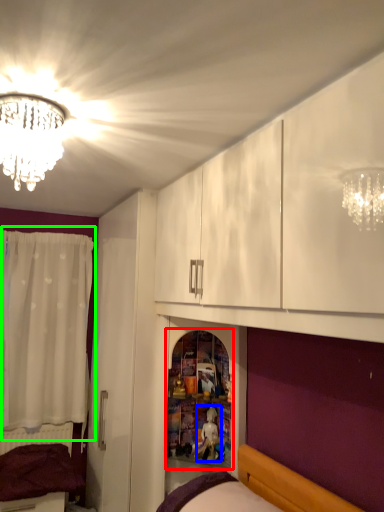
Question: Considering the real-world distances, which object is closest to shelf (highlighted by a red box)? toy (highlighted by a blue box) or curtain (highlighted by a green box).

Choices:
 (A) toy
 (B) curtain

Answer: (A)